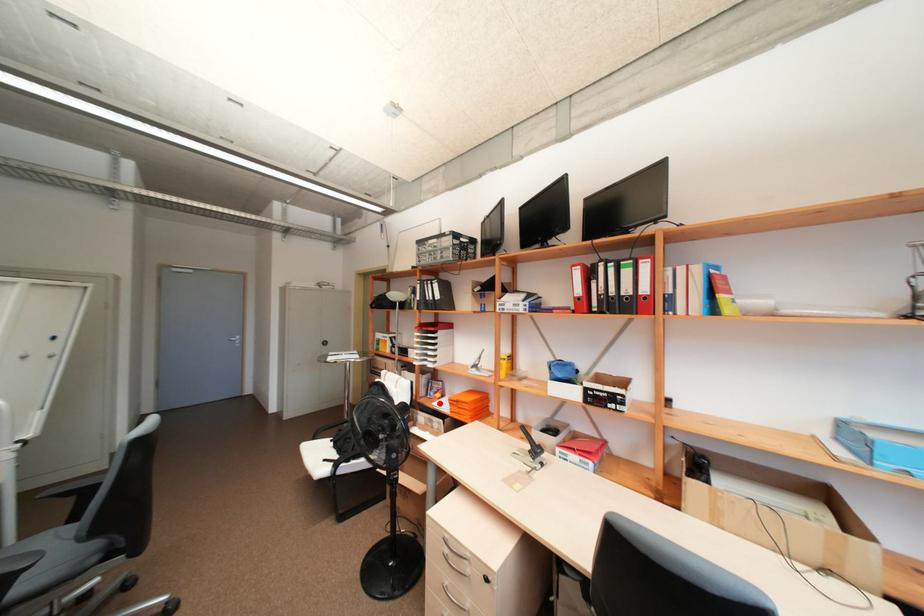
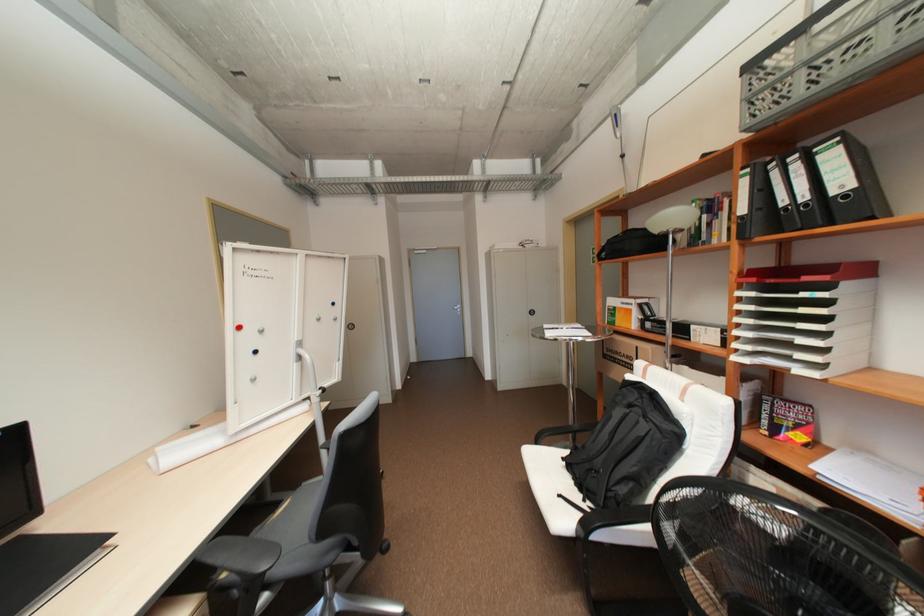
Question: A red point is marked in image1. In image2, is the corresponding 3D point closer to the camera or farther? Reply with the corresponding letter.

Choices:
 (A) The corresponding 3D point is closer.
 (B) The corresponding 3D point is farther.

Answer: (A)